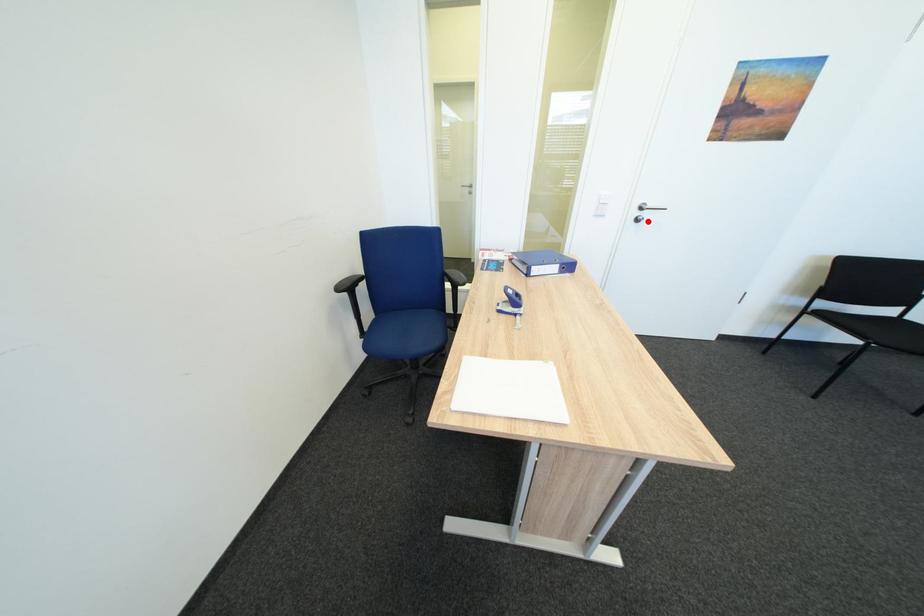
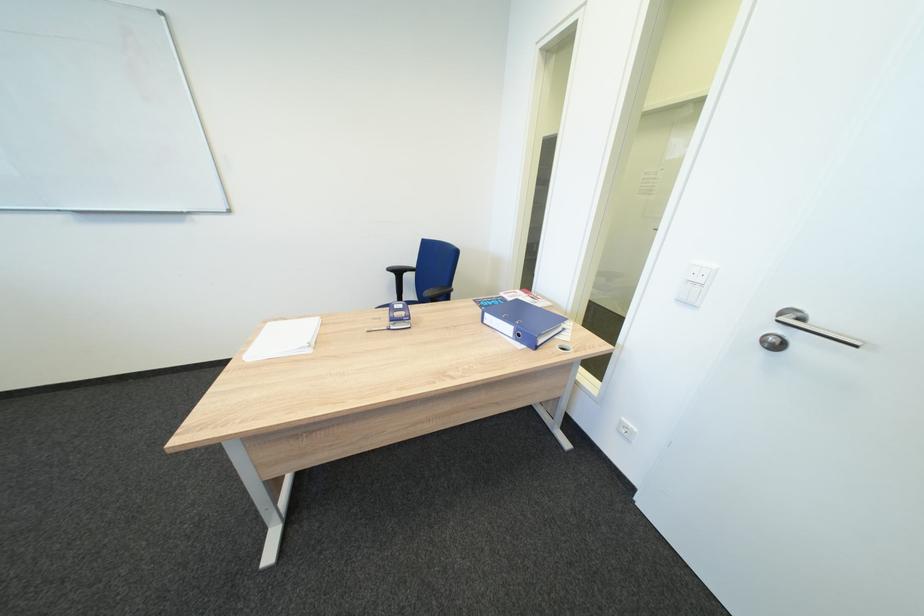
Find the pixel in the second image that matches the highlighted location in the first image.

(784, 346)